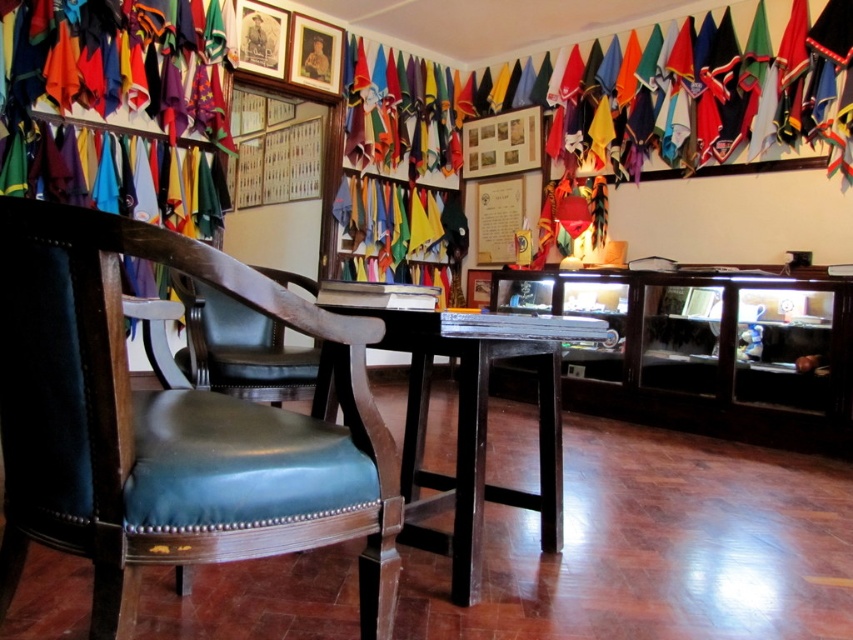
You are a guest at an event and need to place a small gift on the table. The gift requires at least 12 inches of space to be placed safely. Can you determine if there is enough space between the leather at left and the dark wood table at center to place the gift?

The distance between the leather at left and the dark wood table at center is 14.58 inches, which is more than the required 12 inches. Therefore, there is enough space to place the gift safely.

You are standing in the room with the colorful flags and banners. You need to place a small object on the dark wood table at center. Based on its position, where should you walk to reach the table?

The dark wood table at center is located at point (471, 419), so you should walk towards that coordinate to reach the table.